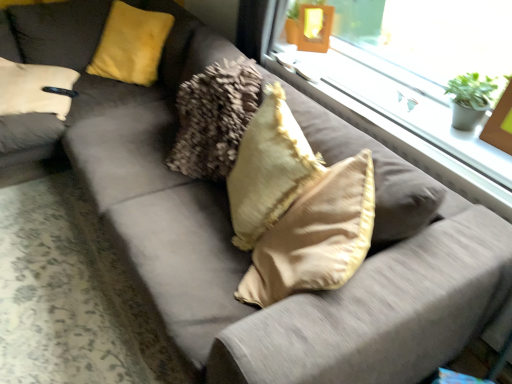
This screenshot has width=512, height=384. Identify the location of vacant area situated to the left side of wooden picture frame at upper right. (477, 147).